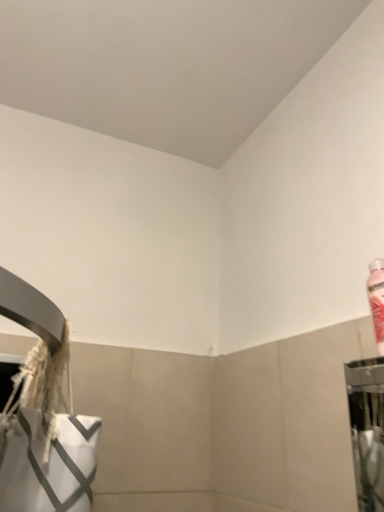
Describe the element at coordinates (377, 300) in the screenshot. This screenshot has width=384, height=512. I see `pink plastic bottle at upper right` at that location.

Where is `pink plastic bottle at upper right`? pink plastic bottle at upper right is located at coordinates (377, 300).

At what (x,y) coordinates should I click in order to perform the action: click on pink plastic bottle at upper right. Please return your answer as a coordinate pair (x, y). This screenshot has width=384, height=512. Looking at the image, I should click on (377, 300).